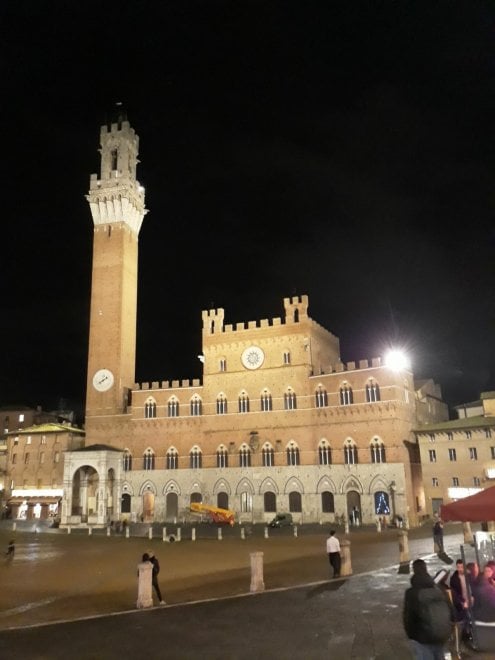
The width and height of the screenshot is (495, 660). I want to click on doorway, so click(x=94, y=505).